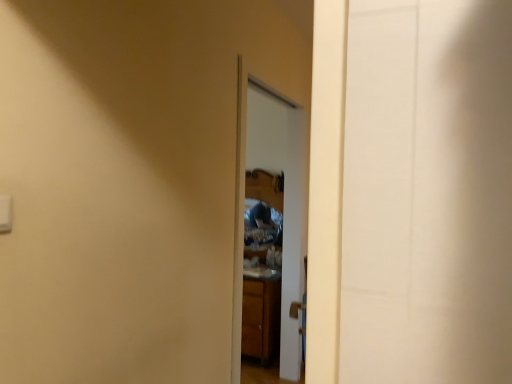
Question: From a real-world perspective, is white plastic light switch at upper left physically below wooden cabinet at center?

Choices:
 (A) no
 (B) yes

Answer: (A)

Question: From the image's perspective, is white plastic light switch at upper left below wooden cabinet at center?

Choices:
 (A) yes
 (B) no

Answer: (B)

Question: Can you confirm if white plastic light switch at upper left is positioned to the right of wooden cabinet at center?

Choices:
 (A) yes
 (B) no

Answer: (B)

Question: From the image's perspective, is white plastic light switch at upper left on top of wooden cabinet at center?

Choices:
 (A) yes
 (B) no

Answer: (A)

Question: Considering the relative sizes of white plastic light switch at upper left and wooden cabinet at center in the image provided, is white plastic light switch at upper left shorter than wooden cabinet at center?

Choices:
 (A) no
 (B) yes

Answer: (B)

Question: Considering the positions of glossy wooden mirror at center and wooden cabinet at center in the image, is glossy wooden mirror at center wider or thinner than wooden cabinet at center?

Choices:
 (A) thin
 (B) wide

Answer: (B)

Question: Visually, is glossy wooden mirror at center positioned to the left or to the right of wooden cabinet at center?

Choices:
 (A) left
 (B) right

Answer: (B)

Question: From their relative heights in the image, would you say glossy wooden mirror at center is taller or shorter than wooden cabinet at center?

Choices:
 (A) tall
 (B) short

Answer: (B)

Question: Does point [x=264, y=180] appear closer or farther from the camera than point [x=259, y=281]?

Choices:
 (A) closer
 (B) farther

Answer: (B)

Question: Is wooden cabinet at center spatially inside glossy wooden mirror at center, or outside of it?

Choices:
 (A) inside
 (B) outside

Answer: (B)

Question: From the image's perspective, is wooden cabinet at center located above or below glossy wooden mirror at center?

Choices:
 (A) below
 (B) above

Answer: (A)

Question: Considering the positions of point (276, 317) and point (261, 208), is point (276, 317) closer or farther from the camera than point (261, 208)?

Choices:
 (A) farther
 (B) closer

Answer: (B)

Question: In terms of size, does wooden cabinet at center appear bigger or smaller than glossy wooden mirror at center?

Choices:
 (A) small
 (B) big

Answer: (A)

Question: Choose the correct answer: Is white plastic light switch at upper left inside glossy wooden mirror at center or outside it?

Choices:
 (A) outside
 (B) inside

Answer: (A)

Question: Is white plastic light switch at upper left in front of or behind glossy wooden mirror at center in the image?

Choices:
 (A) front
 (B) behind

Answer: (A)